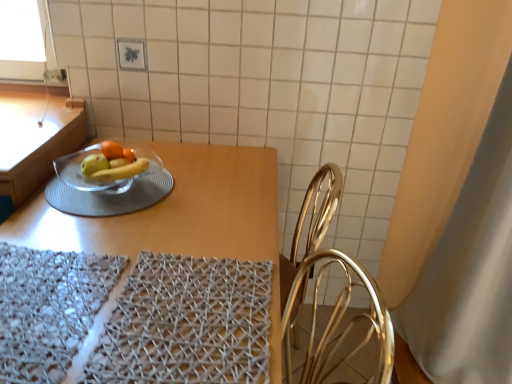
Find the location of a particular element. The width and height of the screenshot is (512, 384). vacant region to the right of transparent glass bowl at center is located at coordinates (214, 198).